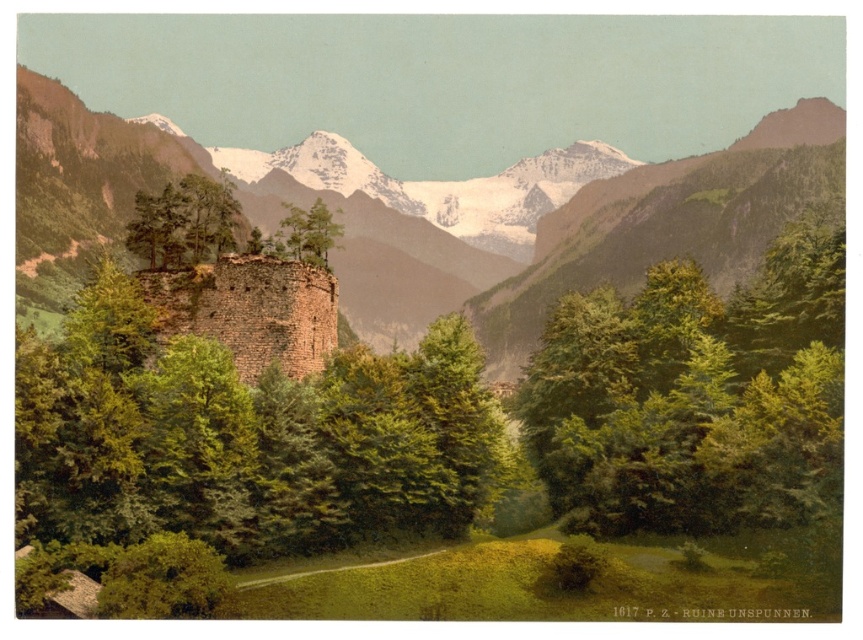
Question: Is the position of brown stone tower at center-left less distant than that of green textured tree at center?

Choices:
 (A) no
 (B) yes

Answer: (B)

Question: Is green leafy tree at center bigger than brown stone tower at center-left?

Choices:
 (A) yes
 (B) no

Answer: (A)

Question: Which of the following is the farthest from the observer?

Choices:
 (A) snowy granite mountains at center
 (B) green textured tree at center

Answer: (B)

Question: Which of these objects is positioned farthest from the snowy granite mountains at center?

Choices:
 (A) brown stone tower at center-left
 (B) green leafy tree at center
 (C) green textured tree at center

Answer: (C)

Question: Among these objects, which one is nearest to the camera?

Choices:
 (A) green leafy tree at center
 (B) snowy granite mountains at center
 (C) brown stone tower at center-left
 (D) green textured tree at center

Answer: (A)

Question: From the image, what is the correct spatial relationship of snowy granite mountains at center in relation to green textured tree at center?

Choices:
 (A) left
 (B) right

Answer: (B)